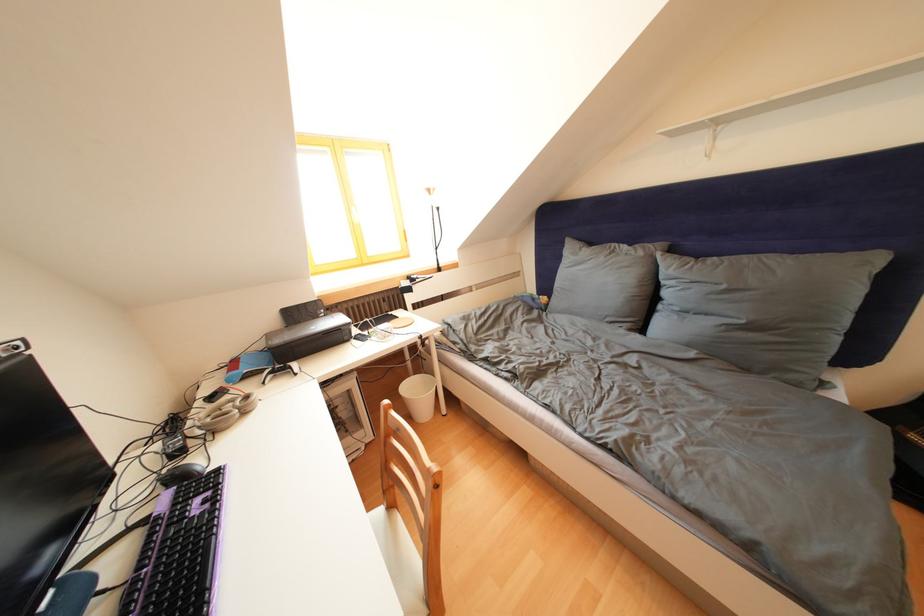
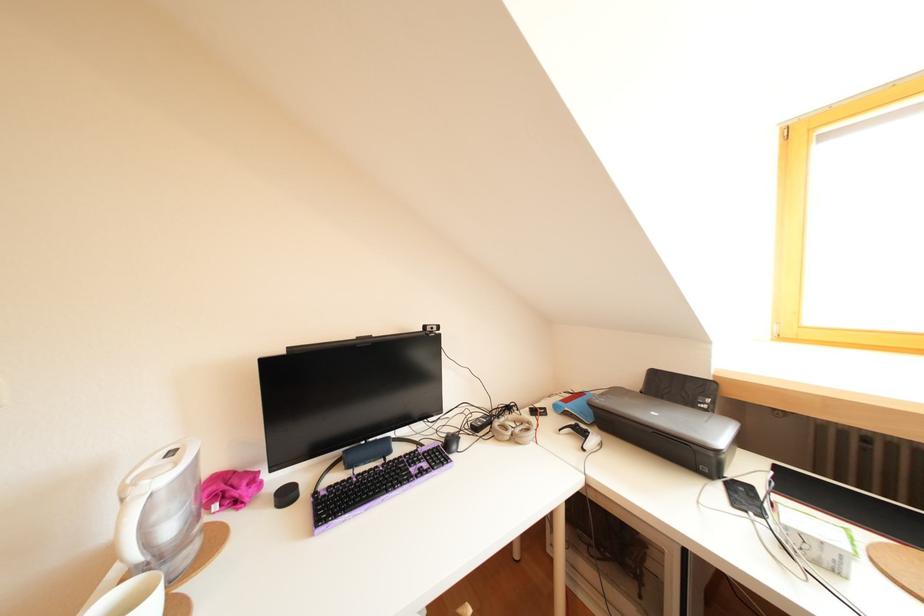
Locate, in the second image, the point that corresponds to (168,495) in the first image.

(453, 445)